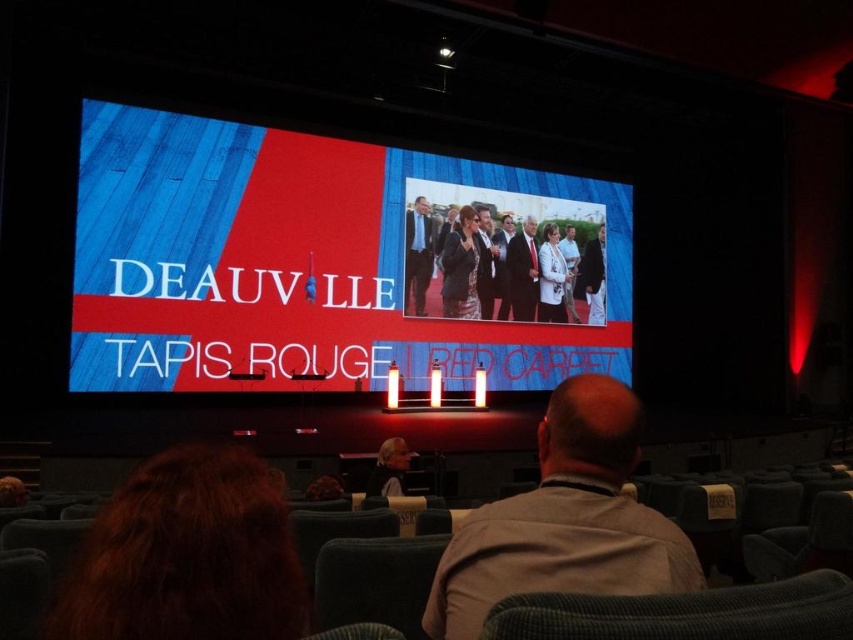
Does point (596, 253) come farther from viewer compared to point (564, 259)?

Yes.

Is point (587, 285) less distant than point (566, 284)?

No, it is behind (566, 284).

Where is `dark gray suit at center`? dark gray suit at center is located at coordinates (595, 276).

Is dark suit at center thinner than light brown leather jacket at lower center?

In fact, dark suit at center might be wider than light brown leather jacket at lower center.

What do you see at coordinates (523, 272) in the screenshot? I see `dark suit at center` at bounding box center [523, 272].

Find the location of a particular element. dark suit at center is located at coordinates (523, 272).

Find the location of a particular element. dark suit at center is located at coordinates (523, 272).

Does gray fabric shirt at center have a lesser width compared to dark blue suit at center?

In fact, gray fabric shirt at center might be wider than dark blue suit at center.

Between point (587, 438) and point (404, 253), which one is positioned behind?

Positioned behind is point (404, 253).

At what (x,y) coordinates should I click in order to perform the action: click on gray fabric shirt at center. Please return your answer as a coordinate pair (x, y). Looking at the image, I should click on coord(564,520).